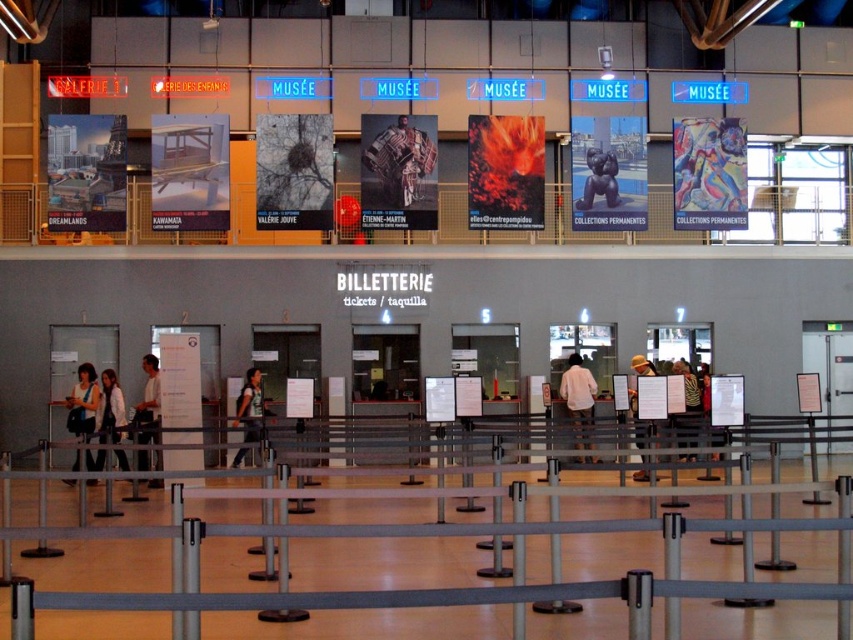
Does abstract painting at upper right have a lesser height compared to white matte shirt at center?

No.

Does point (729, 173) come farther from viewer compared to point (573, 365)?

Yes, point (729, 173) is farther from viewer.

I want to click on abstract painting at upper right, so pos(709,173).

Does green fabric jacket at center have a larger size compared to striped shirt at center?

Incorrect, green fabric jacket at center is not larger than striped shirt at center.

Who is more forward, (241, 388) or (693, 442)?

Positioned in front is point (693, 442).

Where is `green fabric jacket at center`? The width and height of the screenshot is (853, 640). green fabric jacket at center is located at coordinates (250, 406).

Between gray metallic barrier at center and striped shirt at center, which one appears on the right side from the viewer's perspective?

striped shirt at center

Is gray metallic barrier at center wider than striped shirt at center?

No, gray metallic barrier at center is not wider than striped shirt at center.

Identify the location of gray metallic barrier at center. coord(465,586).